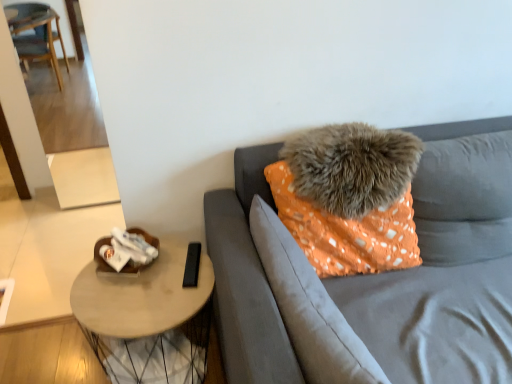
Question: Should I look upward or downward to see orange fabric pillow at center, the 1th pillow ordered from the bottom?

Choices:
 (A) up
 (B) down

Answer: (B)

Question: From the image's perspective, is orange fabric pillow at upper right below light brown wooden table at lower left?

Choices:
 (A) yes
 (B) no

Answer: (B)

Question: Is orange fabric pillow at upper right turned away from light brown wooden table at lower left?

Choices:
 (A) yes
 (B) no

Answer: (B)

Question: Is orange fabric pillow at upper right to the right of light brown wooden table at lower left from the viewer's perspective?

Choices:
 (A) yes
 (B) no

Answer: (A)

Question: Is orange fabric pillow at upper right wider than light brown wooden table at lower left?

Choices:
 (A) no
 (B) yes

Answer: (B)

Question: Can you confirm if orange fabric pillow at upper right is taller than light brown wooden table at lower left?

Choices:
 (A) no
 (B) yes

Answer: (B)

Question: From a real-world perspective, is orange fabric pillow at upper right located beneath light brown wooden table at lower left?

Choices:
 (A) no
 (B) yes

Answer: (A)

Question: Is orange fabric pillow at upper right thinner than orange fabric pillow at center, the second pillow in the top-to-bottom sequence?

Choices:
 (A) yes
 (B) no

Answer: (B)

Question: Is orange fabric pillow at center, the 1th pillow ordered from the bottom, at the back of orange fabric pillow at upper right?

Choices:
 (A) yes
 (B) no

Answer: (B)

Question: Considering the relative sizes of orange fabric pillow at upper right and orange fabric pillow at center, the 1th pillow ordered from the bottom, in the image provided, is orange fabric pillow at upper right bigger than orange fabric pillow at center, the 1th pillow ordered from the bottom,?

Choices:
 (A) yes
 (B) no

Answer: (A)

Question: Is orange fabric pillow at upper right far from orange fabric pillow at center, the 1th pillow ordered from the bottom?

Choices:
 (A) yes
 (B) no

Answer: (B)

Question: Does orange fabric pillow at upper right have a lesser height compared to orange fabric pillow at center, the second pillow in the top-to-bottom sequence?

Choices:
 (A) no
 (B) yes

Answer: (A)

Question: Is orange fabric pillow at upper right closer to the viewer compared to orange fabric pillow at center, the 1th pillow ordered from the bottom?

Choices:
 (A) yes
 (B) no

Answer: (A)

Question: Does orange fabric pillow at center, the 1th pillow ordered from the bottom, have a lesser width compared to orange fabric pillow at upper right?

Choices:
 (A) no
 (B) yes

Answer: (B)